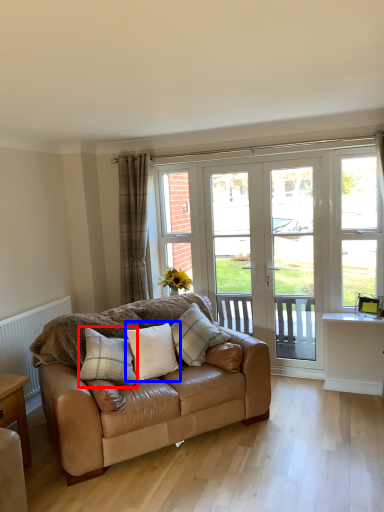
Question: Which object is closer to the camera taking this photo, pillow (highlighted by a red box) or pillow (highlighted by a blue box)?

Choices:
 (A) pillow
 (B) pillow

Answer: (A)